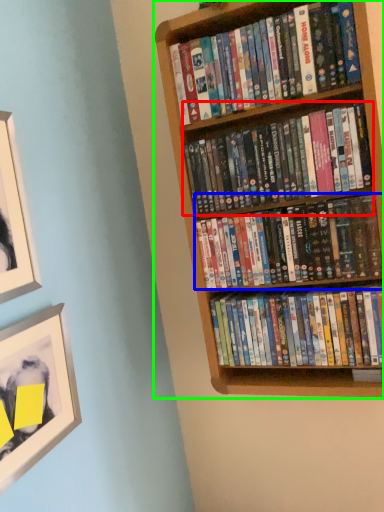
Question: Estimate the real-world distances between objects in this image. Which object is farther from book (highlighted by a red box), book (highlighted by a blue box) or bookcase (highlighted by a green box)?

Choices:
 (A) book
 (B) bookcase

Answer: (B)